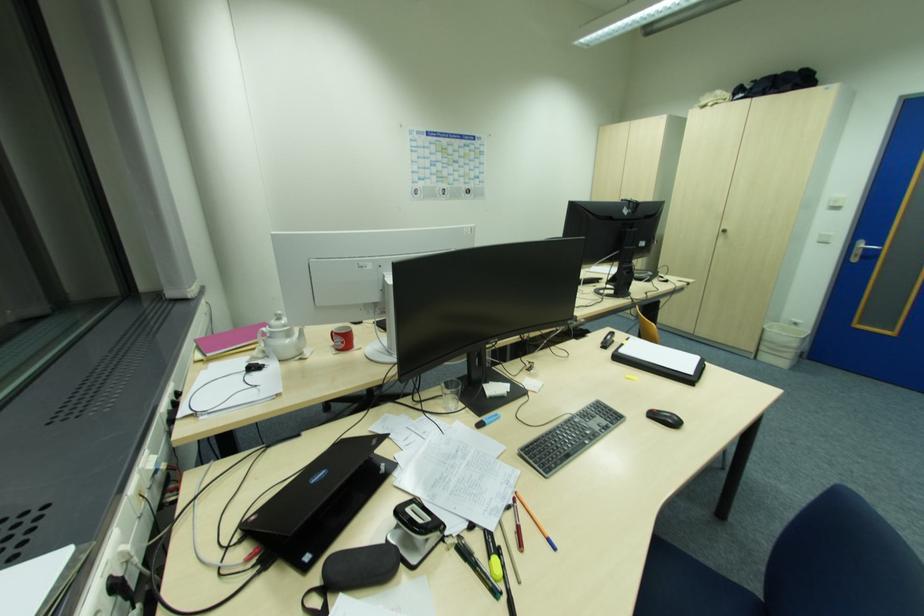
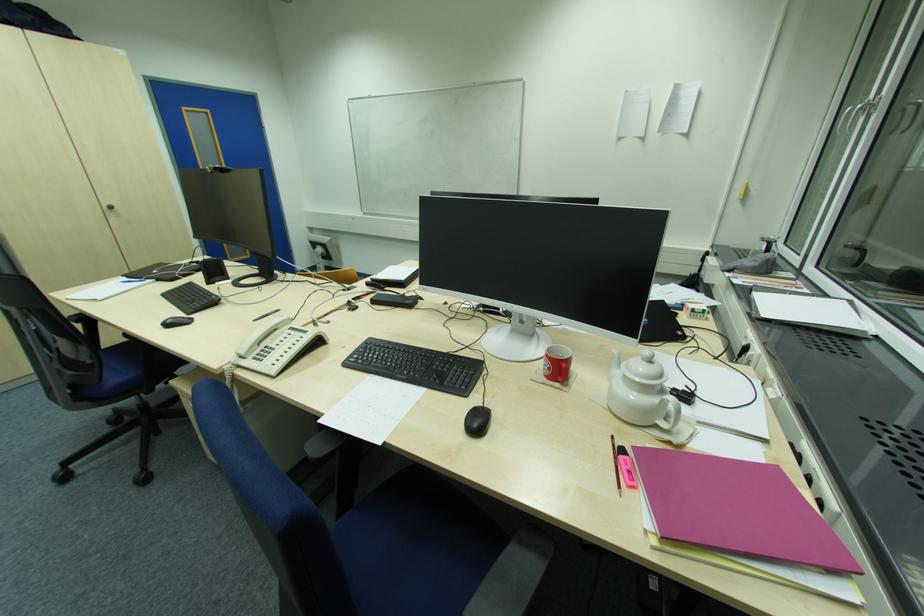
In the second image, find the point that corresponds to [726,232] in the first image.

(114, 209)